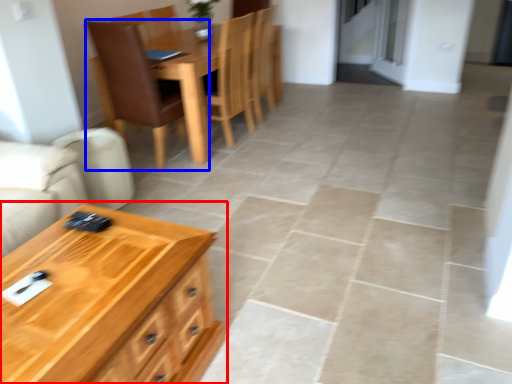
Question: Which of the following is the closest to the observer, table (highlighted by a red box) or chair (highlighted by a blue box)?

Choices:
 (A) table
 (B) chair

Answer: (A)